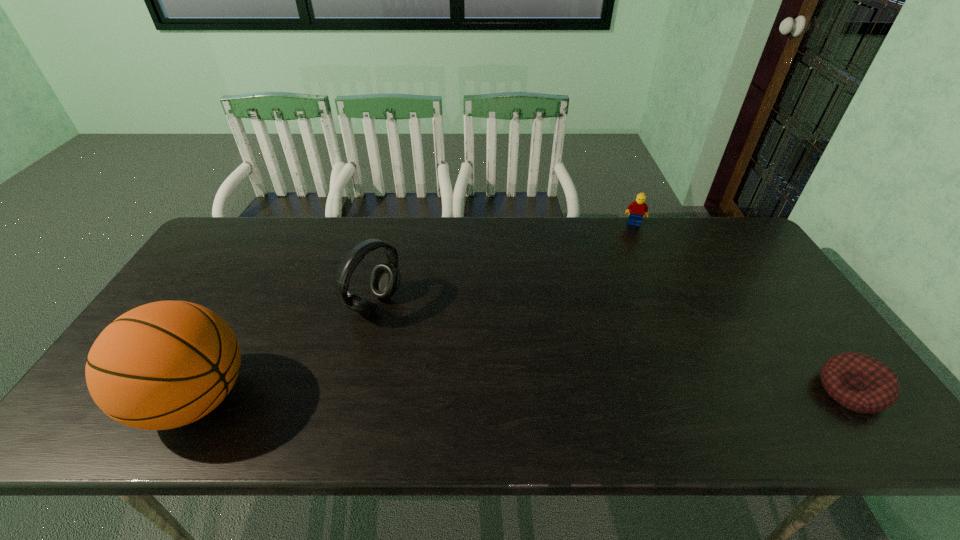
The image size is (960, 540). Identify the location of vacant point located between the farthest object and the second farthest object. (504, 264).

Image resolution: width=960 pixels, height=540 pixels. What are the coordinates of `free space between the third object from left to right and the leftmost object` in the screenshot? It's located at pos(415,311).

This screenshot has height=540, width=960. I want to click on free space that is in between the shortest object and the leftmost object, so click(523, 395).

Find the location of `free space between the tallest object and the second shortest object`. free space between the tallest object and the second shortest object is located at coordinates (415, 311).

Find the location of a particular element. This screenshot has width=960, height=540. unoccupied area between the leftmost object and the farthest object is located at coordinates (415, 311).

Image resolution: width=960 pixels, height=540 pixels. Find the location of `vacant area between the beanbag and the tallest object`. vacant area between the beanbag and the tallest object is located at coordinates (523, 395).

Locate an element on the screen. This screenshot has width=960, height=540. free space between the second object from left to right and the shortest object is located at coordinates (612, 347).

Where is `free area in between the second tallest object and the beanbag`? Image resolution: width=960 pixels, height=540 pixels. free area in between the second tallest object and the beanbag is located at coordinates (612, 347).

Identify which object is the nearest to the Lego. Please provide its 2D coordinates. Your answer should be formatted as a tuple, i.e. [(x, y)], where the tuple contains the x and y coordinates of a point satisfying the conditions above.

[(859, 382)]

You are a GUI agent. You are given a task and a screenshot of the screen. Output one action in this format:
    pyautogui.click(x=<x>, y=<y>)
    Task: Click on the object that is the closest to the beanbag
    The image size is (960, 540).
    Given the screenshot: What is the action you would take?
    pyautogui.click(x=636, y=209)